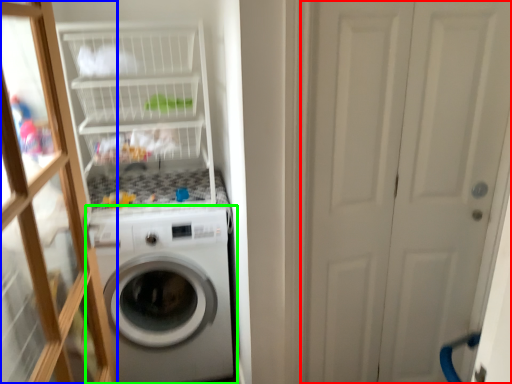
Question: Estimate the real-world distances between objects in this image. Which object is farther from screen door (highlighted by a red box), glass door (highlighted by a blue box) or washing machine (highlighted by a green box)?

Choices:
 (A) glass door
 (B) washing machine

Answer: (A)